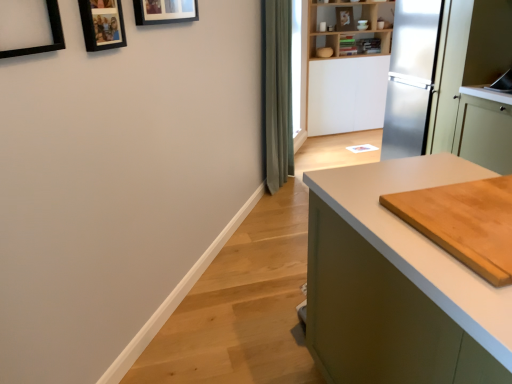
The width and height of the screenshot is (512, 384). What are the coordinates of `vacant region above matte gray countertop at center (from a real-world perspective)` in the screenshot? It's located at pos(459,217).